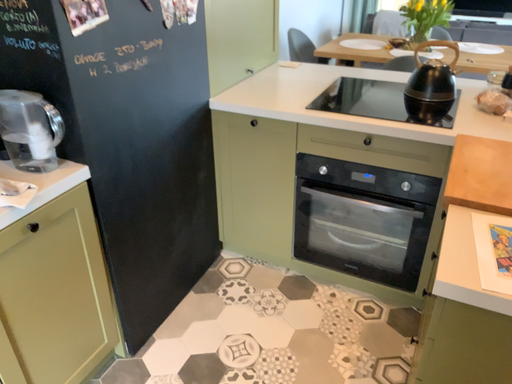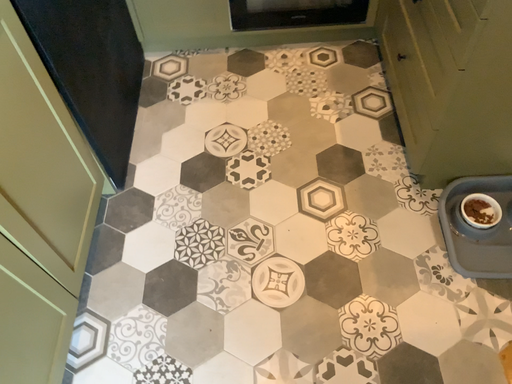
Question: Which way did the camera rotate in the video?

Choices:
 (A) rotated left
 (B) rotated right

Answer: (B)